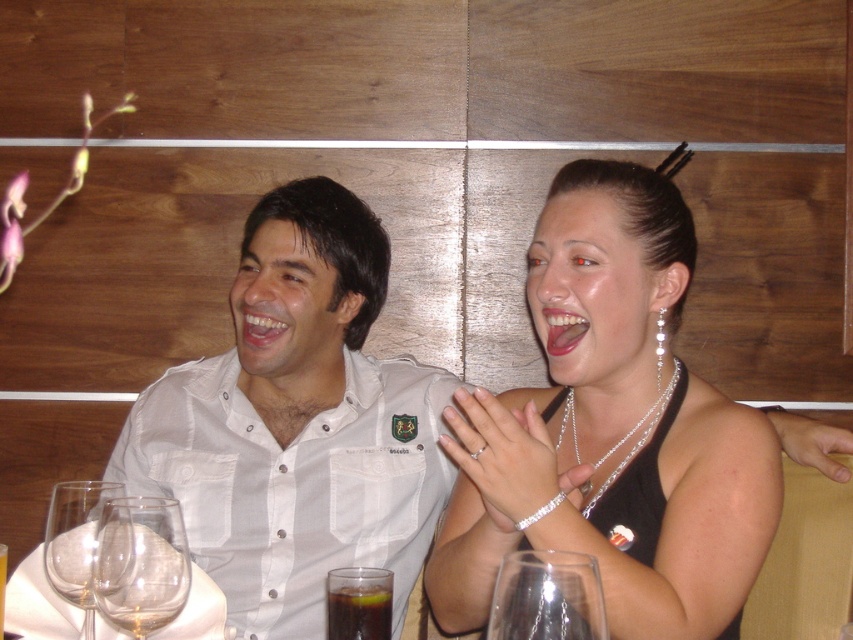
You are a photographer trying to capture a candid shot of the two people in the scene. You notice the satin black dress at center and the transparent glass at lower left. Which object is positioned to the right of the other?

The satin black dress at center is positioned to the right of the transparent glass at lower left.

You are a waiter in a restaurant and need to serve a customer who ordered a drink. You see the transparent glass at lower left and the dark brown liquid at lower center on the table. Which object should you use to pour the drink into the glass?

The transparent glass at lower left should be used to pour the drink into, as it is taller than the dark brown liquid at lower center, indicating it can hold more liquid.

What are the coordinates of the satin black dress at center?

The satin black dress at center is located at coordinates point (611,429).